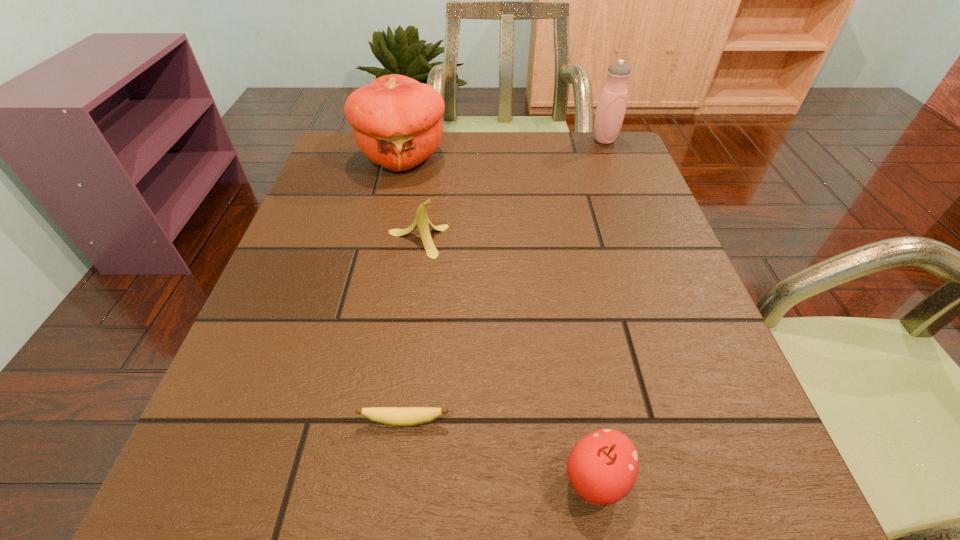
This screenshot has height=540, width=960. In the image, there is a desktop. What are the coordinates of `vacant space at the far edge` in the screenshot? It's located at click(x=475, y=176).

Find the location of a particular element. vacant space at the near edge of the desktop is located at coordinates (434, 518).

You are a GUI agent. You are given a task and a screenshot of the screen. Output one action in this format:
    pyautogui.click(x=<x>, y=<y>)
    Task: Click on the free spot at the left edge of the desktop
    
    Given the screenshot: What is the action you would take?
    pyautogui.click(x=335, y=286)

At what (x,y) coordinates should I click in order to perform the action: click on vacant space at the right edge of the desktop. Please return your answer as a coordinate pair (x, y). Looking at the image, I should click on (660, 246).

In the image, there is a desktop. Where is `free space at the far left corner`? free space at the far left corner is located at coordinates (322, 179).

Locate an element on the screen. This screenshot has width=960, height=540. vacant space at the far right corner of the desktop is located at coordinates (585, 163).

You are a GUI agent. You are given a task and a screenshot of the screen. Output one action in this format:
    pyautogui.click(x=<x>, y=<y>)
    Task: Click on the free location at the near right corner
    Image resolution: width=960 pixels, height=540 pixels.
    Given the screenshot: What is the action you would take?
    pyautogui.click(x=732, y=467)

Locate an element on the screen. Image resolution: width=960 pixels, height=540 pixels. vacant point located between the third nearest object and the rightmost object is located at coordinates (512, 191).

Where is `free space between the shortest object and the pumpkin`? free space between the shortest object and the pumpkin is located at coordinates (403, 289).

You are a GUI agent. You are given a task and a screenshot of the screen. Output one action in this format:
    pyautogui.click(x=<x>, y=<y>)
    Task: Click on the free spot between the thermos bottle and the nearest object
    
    Given the screenshot: What is the action you would take?
    pyautogui.click(x=600, y=309)